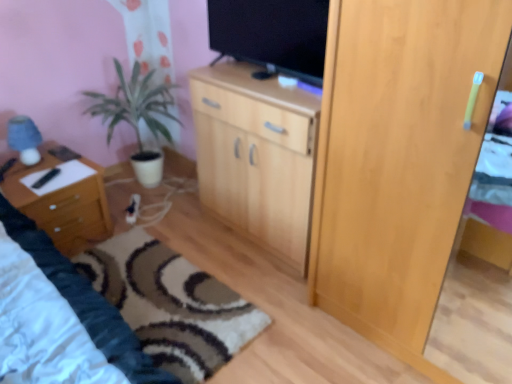
What are the coordinates of `free space in front of green matte plant at left` in the screenshot? It's located at (162, 220).